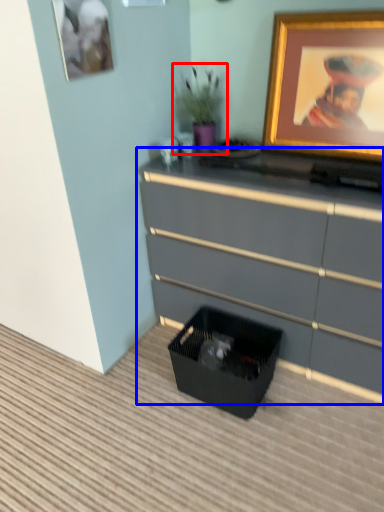
Question: Which of the following is the closest to the observer, houseplant (highlighted by a red box) or chest of drawers (highlighted by a blue box)?

Choices:
 (A) houseplant
 (B) chest of drawers

Answer: (B)